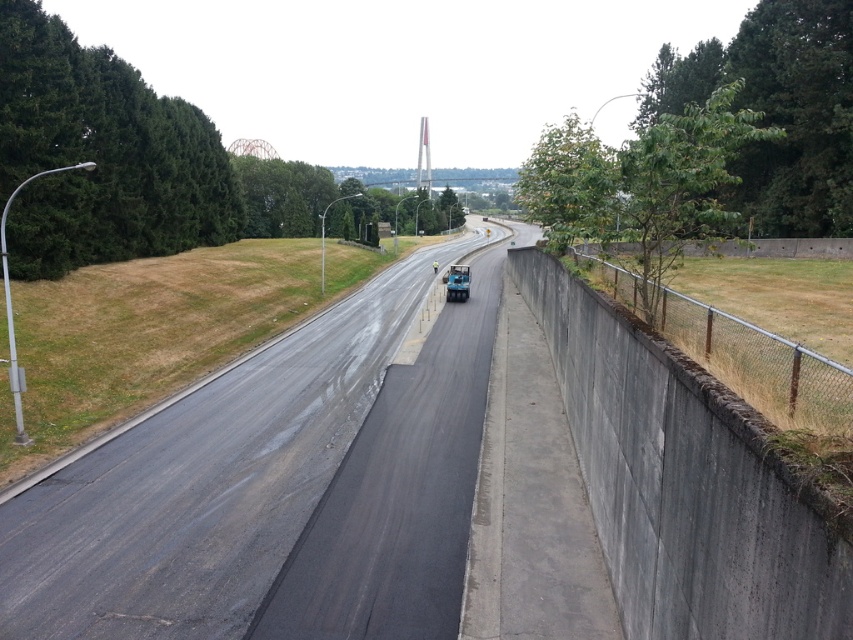
You are a pedestrian standing on the sidewalk and want to cross the road to reach the park on the other side. The black asphalt road at center is under construction. Considering the metallic blue truck at center is blocking the view, can you safely cross the road here?

The black asphalt road at center is in front of the metallic blue truck at center, meaning the truck is behind the road. Since the truck is blocking your view, it might be dangerous to cross here as you cannot see oncoming traffic. It is safer to wait for the truck to move or find another crossing point.

From the picture: Please provide the 2D coordinates of the black asphalt road at center in the image. The coordinates should be in the format of a point with two decimal places, like this example format. Please do not add any extra information besides the coordinates.

The 2D coordinates of the black asphalt road at center are at point (206, 484).

You are a delivery driver approaching the black asphalt road at center with your truck. There is a metallic blue truck at center in front of you. Can you safely pass it on the road?

The black asphalt road at center has a larger size compared to the metallic blue truck at center, so it is possible to safely pass the metallic blue truck at center on the road as there is sufficient space.